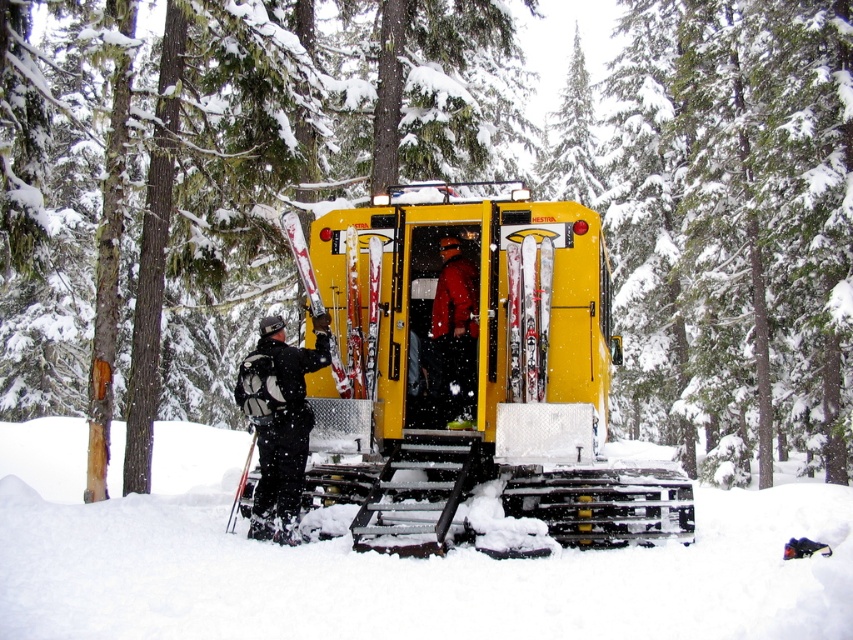
You are navigating through the snowy forest and need to reach a destination located at the coordinates of point (669, 586). You are currently at point (274, 477). Based on the scene description, which direction should you move relative to the snowcat vehicle to reach your destination?

You should move forward relative to the snowcat vehicle because point (669, 586) is in front of point (274, 477).

You are a photographer standing at the camera position. You want to capture a closeup of the white fluffy snow at lower center without moving the camera. Is it possible to do so with a standard zoom lens that has a maximum focal length of 200mm?

The white fluffy snow at lower center and camera are 3.81 meters apart. A standard zoom lens with a 200mm focal length can focus on objects at that distance, so yes, it is possible to capture a closeup of the white fluffy snow at lower center without moving the camera.